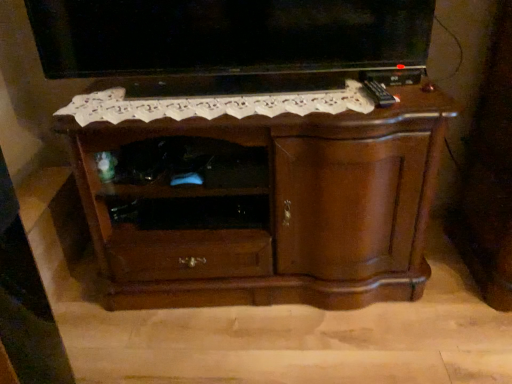
The width and height of the screenshot is (512, 384). I want to click on matte black tv at upper center, so click(228, 36).

The height and width of the screenshot is (384, 512). Describe the element at coordinates (228, 36) in the screenshot. I see `matte black tv at upper center` at that location.

In order to face shiny brown cabinet at center, should I rotate leftwards or rightwards?

A 0.770 degree turn to the right will do.

What do you see at coordinates (260, 197) in the screenshot? I see `shiny brown cabinet at center` at bounding box center [260, 197].

I want to click on shiny brown cabinet at center, so click(x=260, y=197).

Locate an element on the screen. The width and height of the screenshot is (512, 384). matte black tv at upper center is located at coordinates (228, 36).

Considering the positions of objects matte black tv at upper center and shiny brown cabinet at center in the image provided, who is more to the left, matte black tv at upper center or shiny brown cabinet at center?

matte black tv at upper center.

Which object is more forward, matte black tv at upper center or shiny brown cabinet at center?

Positioned in front is shiny brown cabinet at center.

Considering the positions of points (135, 31) and (258, 279), is point (135, 31) closer to camera compared to point (258, 279)?

Yes, it is in front of point (258, 279).

Looking at this image, from the image's perspective, which is below, matte black tv at upper center or shiny brown cabinet at center?

shiny brown cabinet at center.

From a real-world perspective, who is located higher, matte black tv at upper center or shiny brown cabinet at center?

In real-world perspective, matte black tv at upper center is above.

Can you confirm if matte black tv at upper center is wider than shiny brown cabinet at center?

Incorrect, the width of matte black tv at upper center does not surpass that of shiny brown cabinet at center.

Is matte black tv at upper center taller or shorter than shiny brown cabinet at center?

matte black tv at upper center is shorter than shiny brown cabinet at center.

Is matte black tv at upper center bigger or smaller than shiny brown cabinet at center?

matte black tv at upper center is smaller than shiny brown cabinet at center.

Is shiny brown cabinet at center located within matte black tv at upper center?

Actually, shiny brown cabinet at center is outside matte black tv at upper center.

Is matte black tv at upper center directly adjacent to shiny brown cabinet at center?

matte black tv at upper center and shiny brown cabinet at center are not in contact.

Is matte black tv at upper center oriented towards shiny brown cabinet at center?

No, matte black tv at upper center is not facing towards shiny brown cabinet at center.

Where is `chest of drawers below the matte black tv at upper center (from the image's perspective)`? The width and height of the screenshot is (512, 384). chest of drawers below the matte black tv at upper center (from the image's perspective) is located at coordinates (260, 197).

Does shiny brown cabinet at center appear on the right side of matte black tv at upper center?

Yes, shiny brown cabinet at center is to the right of matte black tv at upper center.

Is the position of shiny brown cabinet at center more distant than that of matte black tv at upper center?

No, it is not.

Which is behind, point (89, 180) or point (264, 5)?

The point (89, 180) is farther from the camera.

From the image's perspective, which one is positioned lower, shiny brown cabinet at center or matte black tv at upper center?

From the image's view, shiny brown cabinet at center is below.

Looking at this image, from a real-world perspective, who is located higher, shiny brown cabinet at center or matte black tv at upper center?

From a 3D spatial view, matte black tv at upper center is above.

Considering the relative sizes of shiny brown cabinet at center and matte black tv at upper center in the image provided, is shiny brown cabinet at center thinner than matte black tv at upper center?

In fact, shiny brown cabinet at center might be wider than matte black tv at upper center.

Between shiny brown cabinet at center and matte black tv at upper center, which one has less height?

Standing shorter between the two is matte black tv at upper center.

Looking at the image, does shiny brown cabinet at center seem bigger or smaller compared to matte black tv at upper center?

In the image, shiny brown cabinet at center appears to be larger than matte black tv at upper center.

Which is correct: shiny brown cabinet at center is inside matte black tv at upper center, or outside of it?

shiny brown cabinet at center is outside matte black tv at upper center.

Is the surface of shiny brown cabinet at center in direct contact with matte black tv at upper center?

No, shiny brown cabinet at center is not next to matte black tv at upper center.

In the scene shown: Is shiny brown cabinet at center facing towards matte black tv at upper center?

No, shiny brown cabinet at center is not aimed at matte black tv at upper center.

How many degrees apart are the facing directions of shiny brown cabinet at center and matte black tv at upper center?

2.13 degrees.

Image resolution: width=512 pixels, height=384 pixels. Find the location of `the chest of drawers that appears below the matte black tv at upper center (from the image's perspective)`. the chest of drawers that appears below the matte black tv at upper center (from the image's perspective) is located at coordinates (260, 197).

Locate an element on the screen. This screenshot has height=384, width=512. the chest of drawers that is under the matte black tv at upper center (from a real-world perspective) is located at coordinates (260, 197).

Locate an element on the screen. The image size is (512, 384). chest of drawers in front of the matte black tv at upper center is located at coordinates (260, 197).